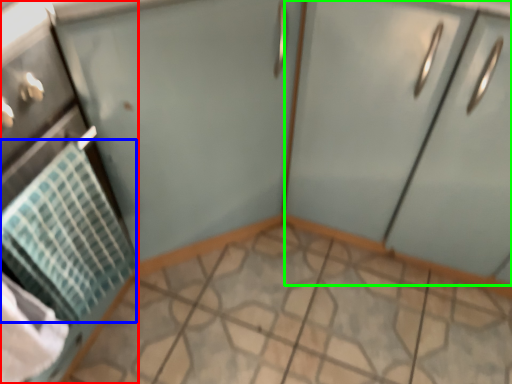
Question: Which object is positioned closest to appliance (highlighted by a red box)? Select from blanket (highlighted by a blue box) and cabinetry (highlighted by a green box).

Choices:
 (A) blanket
 (B) cabinetry

Answer: (A)